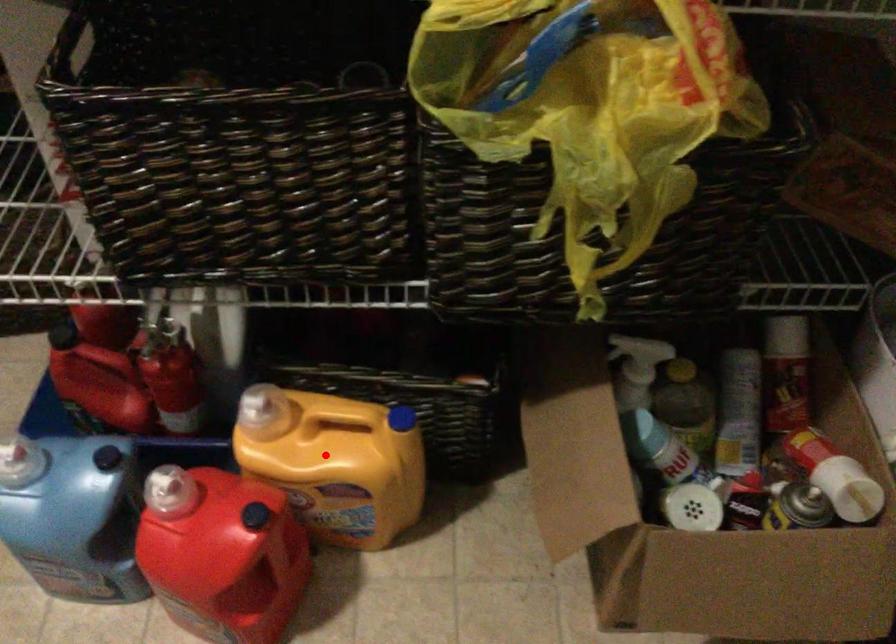
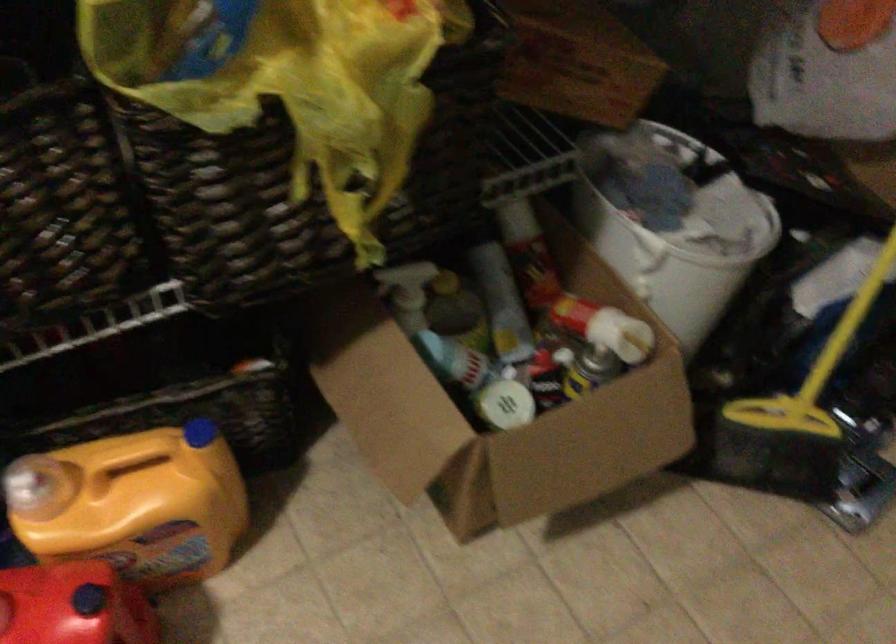
Question: I am providing you with two images of the same scene from different viewpoints. In image1, a red point is highlighted. Considering the same 3D point in image2, which of the following is correct?

Choices:
 (A) It is closer
 (B) It is farther

Answer: (A)